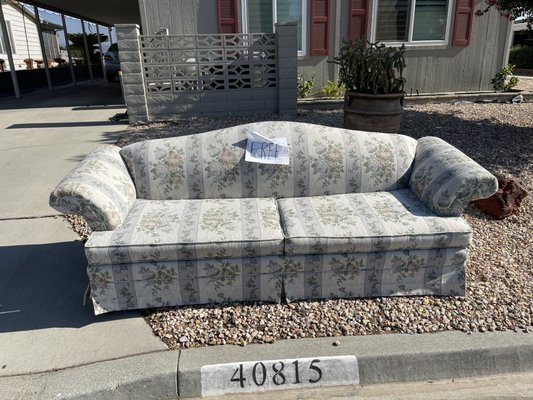
What are the coordinates of `cushions` in the screenshot? It's located at (221, 217), (330, 223).